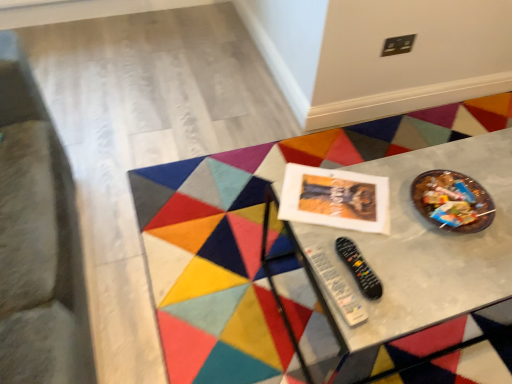
Question: From a real-world perspective, is black plastic remote at center, placed as the second control when sorted from left to right, physically above black plastic remote at lower center, arranged as the 2th control when viewed from the right?

Choices:
 (A) no
 (B) yes

Answer: (A)

Question: Is black plastic remote at center, placed as the second control when sorted from left to right, not inside black plastic remote at lower center, arranged as the 2th control when viewed from the right?

Choices:
 (A) yes
 (B) no

Answer: (A)

Question: Is black plastic remote at lower center, placed as the first control when sorted from left to right, at the back of black plastic remote at center, placed as the second control when sorted from left to right?

Choices:
 (A) yes
 (B) no

Answer: (B)

Question: From the image's perspective, is black plastic remote at center, placed as the second control when sorted from left to right, on black plastic remote at lower center, arranged as the 2th control when viewed from the right?

Choices:
 (A) no
 (B) yes

Answer: (B)

Question: Is black plastic remote at center, the first control when ordered from right to left, to the left of black plastic remote at lower center, arranged as the 2th control when viewed from the right, from the viewer's perspective?

Choices:
 (A) no
 (B) yes

Answer: (A)

Question: Do you think black plastic remote at center, placed as the second control when sorted from left to right, is within metallic gray table at center, or outside of it?

Choices:
 (A) outside
 (B) inside

Answer: (A)

Question: Does point (381, 291) appear closer or farther from the camera than point (438, 319)?

Choices:
 (A) farther
 (B) closer

Answer: (A)

Question: Based on their sizes in the image, would you say black plastic remote at center, placed as the second control when sorted from left to right, is bigger or smaller than metallic gray table at center?

Choices:
 (A) small
 (B) big

Answer: (A)

Question: Relative to metallic gray table at center, is black plastic remote at center, the first control when ordered from right to left, in front or behind?

Choices:
 (A) behind
 (B) front

Answer: (B)

Question: Is metallic gray table at center to the left or to the right of black plastic remote at lower center, placed as the first control when sorted from left to right, in the image?

Choices:
 (A) right
 (B) left

Answer: (A)

Question: Considering the positions of point (470, 322) and point (325, 268), is point (470, 322) closer or farther from the camera than point (325, 268)?

Choices:
 (A) farther
 (B) closer

Answer: (A)

Question: Choose the correct answer: Is metallic gray table at center inside black plastic remote at lower center, placed as the first control when sorted from left to right, or outside it?

Choices:
 (A) inside
 (B) outside

Answer: (B)

Question: Looking at their shapes, would you say metallic gray table at center is wider or thinner than black plastic remote at lower center, arranged as the 2th control when viewed from the right?

Choices:
 (A) thin
 (B) wide

Answer: (B)

Question: Which is correct: metallic gray table at center is inside black plastic remote at center, placed as the second control when sorted from left to right, or outside of it?

Choices:
 (A) outside
 (B) inside

Answer: (A)

Question: Is metallic gray table at center in front of or behind black plastic remote at center, placed as the second control when sorted from left to right, in the image?

Choices:
 (A) front
 (B) behind

Answer: (B)